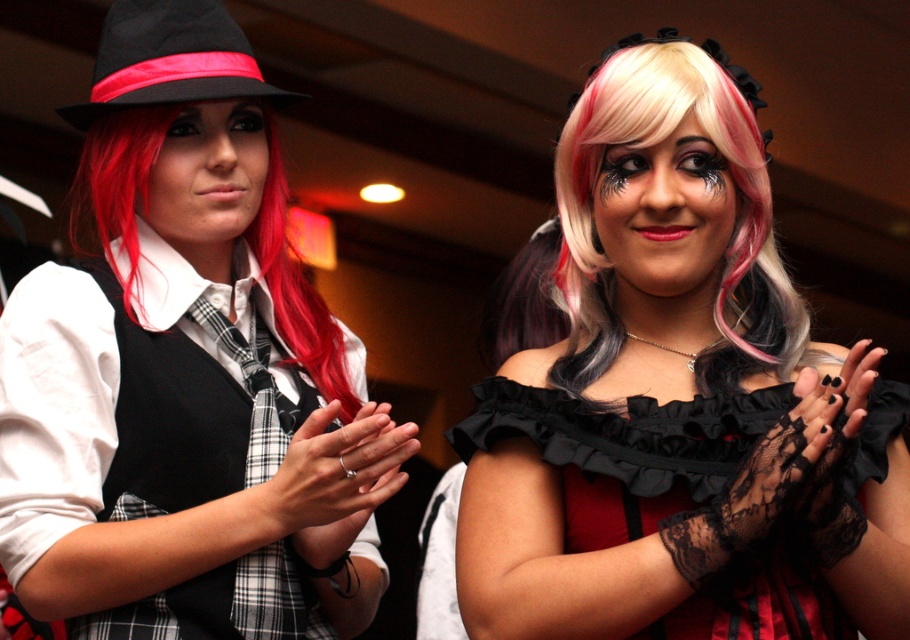
You are at a costume party and notice two items in the image. The first is the matte black hat at upper left, and the second is the black lace dress at center. From your vantage point, which item appears higher up in the image?

The matte black hat at upper left appears higher up in the image than the black lace dress at center because it is positioned above it according to the description.

Consider the image. You are a photographer setting up a backdrop for a photoshoot. You need to ensure that the matte black hat at upper left and the black lace dress at center are both visible in the frame. Considering their heights, which object should you adjust the camera angle to focus on first to capture both effectively?

The matte black hat at upper left is much taller than the black lace dress at center, so you should adjust the camera angle to focus on the matte black hat at upper left first to ensure both are visible in the frame.